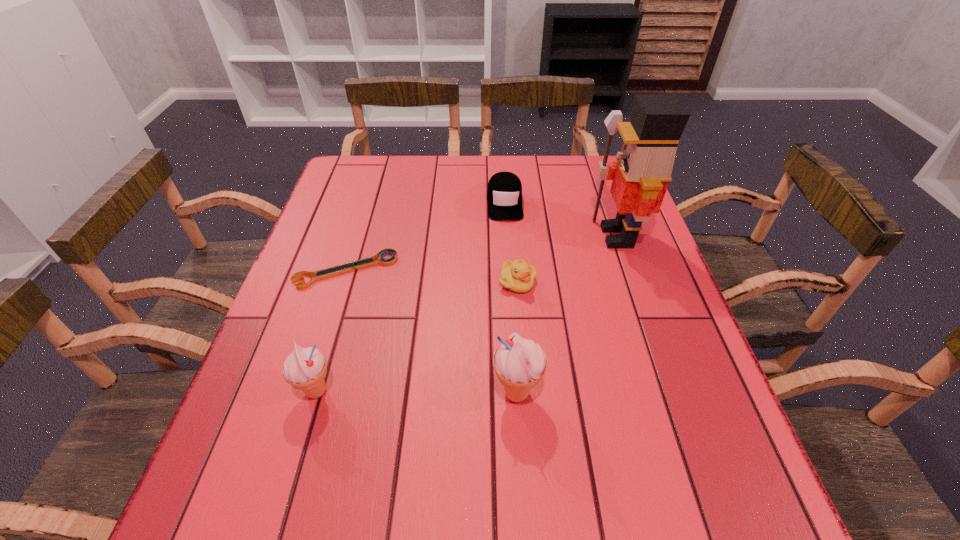
Where is `vacant space situated 0.370m on the left of the right icecream`? vacant space situated 0.370m on the left of the right icecream is located at coordinates (298, 393).

Locate an element on the screen. The image size is (960, 540). vacant area situated 0.280m on the front-facing side of the cap is located at coordinates (511, 296).

Locate an element on the screen. The height and width of the screenshot is (540, 960). vacant area situated 0.240m on the front of the shortest object is located at coordinates (313, 377).

Image resolution: width=960 pixels, height=540 pixels. Identify the location of free space located on the front-facing side of the duckling. tap(532, 458).

Locate an element on the screen. Image resolution: width=960 pixels, height=540 pixels. vacant area situated 0.140m in front of the tallest object holding the staff is located at coordinates (537, 237).

You are a GUI agent. You are given a task and a screenshot of the screen. Output one action in this format:
    pyautogui.click(x=<x>, y=<y>)
    Task: Click on the free spot located 0.270m in front of the tallest object holding the staff
    The width and height of the screenshot is (960, 540).
    Given the screenshot: What is the action you would take?
    488,237

Where is `free space located 0.390m in front of the tallest object holding the staff`? The image size is (960, 540). free space located 0.390m in front of the tallest object holding the staff is located at coordinates (443, 237).

Locate an element on the screen. The image size is (960, 540). object at the far edge is located at coordinates (504, 193).

In order to click on object that is at the near edge in this screenshot , I will do `click(519, 364)`.

Find the location of `icecream present at the left edge`. icecream present at the left edge is located at coordinates (305, 369).